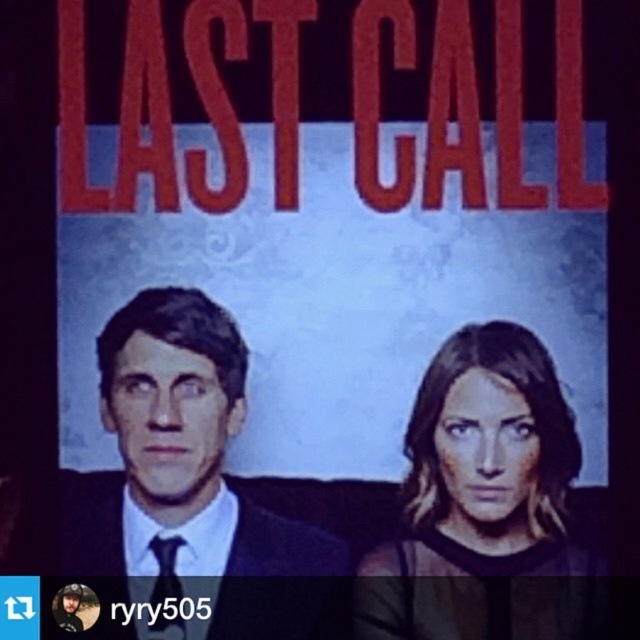
Does matte black suit at left have a greater height compared to smooth brown hair at center?

Yes.

Does matte black suit at left appear on the left side of smooth brown hair at center?

Indeed, matte black suit at left is positioned on the left side of smooth brown hair at center.

Locate an element on the screen. matte black suit at left is located at coordinates click(184, 484).

This screenshot has height=640, width=640. In order to click on matte black suit at left in this screenshot , I will do `click(184, 484)`.